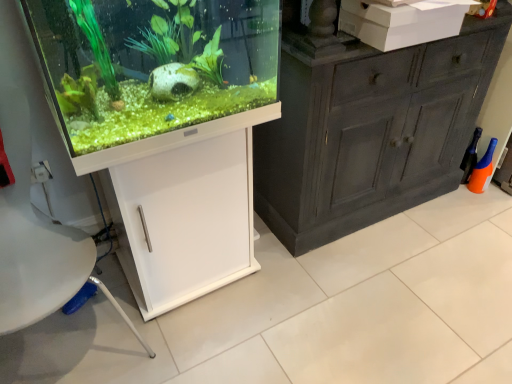
Question: Considering the positions of white matte cabinet at lower left and white cardboard box at upper right in the image, is white matte cabinet at lower left taller or shorter than white cardboard box at upper right?

Choices:
 (A) tall
 (B) short

Answer: (A)

Question: Is white matte cabinet at lower left bigger or smaller than white cardboard box at upper right?

Choices:
 (A) small
 (B) big

Answer: (B)

Question: Based on their positions, is white matte cabinet at lower left located to the left or right of white cardboard box at upper right?

Choices:
 (A) right
 (B) left

Answer: (B)

Question: Considering the positions of white cardboard box at upper right and white matte cabinet at lower left in the image, is white cardboard box at upper right bigger or smaller than white matte cabinet at lower left?

Choices:
 (A) big
 (B) small

Answer: (B)

Question: In terms of height, does white cardboard box at upper right look taller or shorter compared to white matte cabinet at lower left?

Choices:
 (A) short
 (B) tall

Answer: (A)

Question: Is white cardboard box at upper right wider or thinner than white matte cabinet at lower left?

Choices:
 (A) thin
 (B) wide

Answer: (A)

Question: Is point (437, 1) closer or farther from the camera than point (152, 296)?

Choices:
 (A) farther
 (B) closer

Answer: (B)